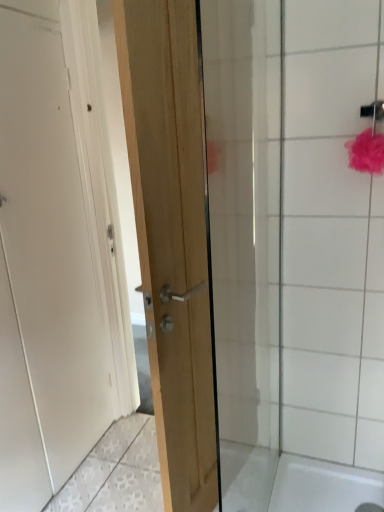
Question: From a real-world perspective, is white glossy shower door at upper right located beneath natural wood door at center, which ranks as the second door in left-to-right order?

Choices:
 (A) no
 (B) yes

Answer: (B)

Question: Does white glossy shower door at upper right have a larger size compared to natural wood door at center, which ranks as the second door in left-to-right order?

Choices:
 (A) no
 (B) yes

Answer: (A)

Question: Does white glossy shower door at upper right have a greater width compared to natural wood door at center, which ranks as the second door in left-to-right order?

Choices:
 (A) yes
 (B) no

Answer: (B)

Question: Is white glossy shower door at upper right to the right of natural wood door at center, marked as the 1th door in a right-to-left arrangement, from the viewer's perspective?

Choices:
 (A) no
 (B) yes

Answer: (B)

Question: Is the position of white glossy shower door at upper right less distant than that of natural wood door at center, which ranks as the second door in left-to-right order?

Choices:
 (A) no
 (B) yes

Answer: (A)

Question: In the image, is white glossy shower door at upper right positioned in front of or behind white matte door at left, the 1th door from the left?

Choices:
 (A) behind
 (B) front

Answer: (A)

Question: Looking at their shapes, would you say white glossy shower door at upper right is wider or thinner than white matte door at left, the 1th door from the left?

Choices:
 (A) thin
 (B) wide

Answer: (A)

Question: Do you think white glossy shower door at upper right is within white matte door at left, the second door viewed from the right, or outside of it?

Choices:
 (A) inside
 (B) outside

Answer: (B)

Question: Is point (241, 351) closer or farther from the camera than point (57, 348)?

Choices:
 (A) farther
 (B) closer

Answer: (B)

Question: From a real-world perspective, is white glossy shower door at upper right above or below natural wood door at center, which ranks as the second door in left-to-right order?

Choices:
 (A) below
 (B) above

Answer: (A)

Question: Based on their sizes in the image, would you say white glossy shower door at upper right is bigger or smaller than natural wood door at center, which ranks as the second door in left-to-right order?

Choices:
 (A) big
 (B) small

Answer: (B)

Question: In terms of width, does white glossy shower door at upper right look wider or thinner when compared to natural wood door at center, marked as the 1th door in a right-to-left arrangement?

Choices:
 (A) thin
 (B) wide

Answer: (A)

Question: Considering their positions, is white glossy shower door at upper right located in front of or behind natural wood door at center, marked as the 1th door in a right-to-left arrangement?

Choices:
 (A) front
 (B) behind

Answer: (B)

Question: Based on their sizes in the image, would you say white matte door at left, the 1th door from the left, is bigger or smaller than white glossy shower door at upper right?

Choices:
 (A) big
 (B) small

Answer: (A)

Question: Considering the positions of point (28, 150) and point (367, 61), is point (28, 150) closer or farther from the camera than point (367, 61)?

Choices:
 (A) farther
 (B) closer

Answer: (A)